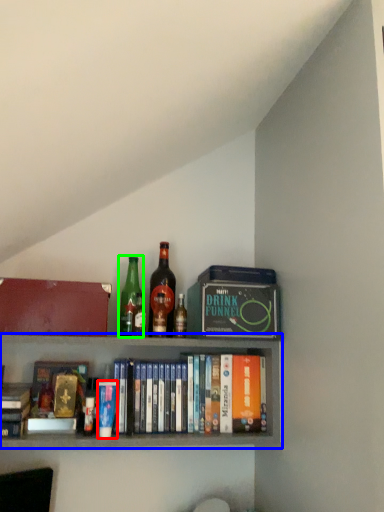
Question: Estimate the real-world distances between objects in this image. Which object is closer to paperback book (highlighted by a red box), shelf (highlighted by a blue box) or bottle (highlighted by a green box)?

Choices:
 (A) shelf
 (B) bottle

Answer: (A)